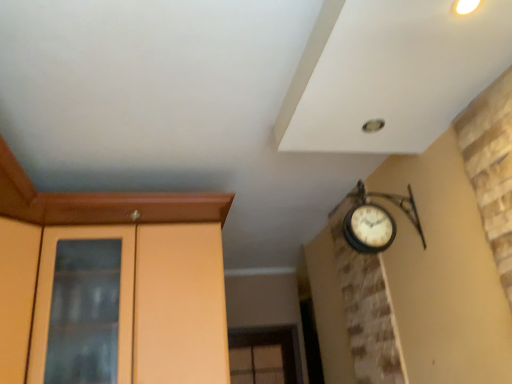
Image resolution: width=512 pixels, height=384 pixels. What do you see at coordinates (154, 303) in the screenshot?
I see `matte wood dresser at left` at bounding box center [154, 303].

Where is `matte wood dresser at left`? This screenshot has height=384, width=512. matte wood dresser at left is located at coordinates (154, 303).

I want to click on matte wood door at left, so click(x=17, y=295).

Describe the element at coordinates (17, 295) in the screenshot. I see `matte wood door at left` at that location.

What are the coordinates of `matte wood dresser at left` in the screenshot? It's located at (154, 303).

Which object is positioned more to the right, matte wood door at left or matte wood dresser at left?

From the viewer's perspective, matte wood dresser at left appears more on the right side.

Between matte wood door at left and matte wood dresser at left, which one is positioned in front?

matte wood door at left is more forward.

Is point (14, 310) in front of point (206, 240)?

Yes, point (14, 310) is closer to viewer.

From the image's perspective, would you say matte wood door at left is shown under matte wood dresser at left?

No, from the image's perspective, matte wood door at left is not beneath matte wood dresser at left.

From a real-world perspective, who is located higher, matte wood door at left or matte wood dresser at left?

In real-world perspective, matte wood door at left is above.

Is matte wood door at left wider or thinner than matte wood dresser at left?

Clearly, matte wood door at left has more width compared to matte wood dresser at left.

Can you confirm if matte wood door at left is taller than matte wood dresser at left?

No, matte wood door at left is not taller than matte wood dresser at left.

Considering the relative sizes of matte wood door at left and matte wood dresser at left in the image provided, is matte wood door at left bigger than matte wood dresser at left?

No.

Is matte wood dresser at left located within matte wood door at left?

No, matte wood dresser at left is not a part of matte wood door at left.

Is matte wood door at left beside matte wood dresser at left?

No, matte wood door at left is not with matte wood dresser at left.

Is matte wood door at left facing towards matte wood dresser at left?

No, matte wood door at left is not turned towards matte wood dresser at left.

How many degrees apart are the facing directions of matte wood door at left and matte wood dresser at left?

0.0117 degrees.

Find the location of a particular element. Image resolution: width=512 pixels, height=384 pixels. dresser below the matte wood door at left (from a real-world perspective) is located at coordinates (154, 303).

In the scene shown: Is matte wood dresser at left to the left or to the right of matte wood door at left in the image?

matte wood dresser at left is positioned on matte wood door at left's right side.

Between matte wood dresser at left and matte wood door at left, which one is positioned behind?

matte wood dresser at left is further away from the camera.

Which is farther from the camera, (172, 356) or (9, 275)?

The point (172, 356) is behind.

From the image's perspective, is matte wood dresser at left below matte wood door at left?

Correct, matte wood dresser at left appears lower than matte wood door at left in the image.

From a real-world perspective, who is located higher, matte wood dresser at left or matte wood door at left?

matte wood door at left is physically above.

Considering the sizes of matte wood dresser at left and matte wood door at left in the image, is matte wood dresser at left wider or thinner than matte wood door at left?

Considering their sizes, matte wood dresser at left looks slimmer than matte wood door at left.

Can you confirm if matte wood dresser at left is shorter than matte wood door at left?

No.

Between matte wood dresser at left and matte wood door at left, which one has smaller size?

matte wood door at left.

Is matte wood door at left completely or partially inside matte wood dresser at left?

No, matte wood door at left is not surrounded by matte wood dresser at left.

Is the surface of matte wood dresser at left in direct contact with matte wood door at left?

No, matte wood dresser at left is not making contact with matte wood door at left.

Is matte wood dresser at left aimed at matte wood door at left?

No.

What's the angular difference between matte wood dresser at left and matte wood door at left's facing directions?

There is a 0.0117-degree angle between the facing directions of matte wood dresser at left and matte wood door at left.

At what (x,y) coordinates should I click in order to perform the action: click on door on the left of the matte wood dresser at left. Please return your answer as a coordinate pair (x, y). Looking at the image, I should click on (17, 295).

I want to click on dresser on the right of matte wood door at left, so click(x=154, y=303).

This screenshot has height=384, width=512. Identify the location of door that is above the matte wood dresser at left (from the image's perspective). (17, 295).